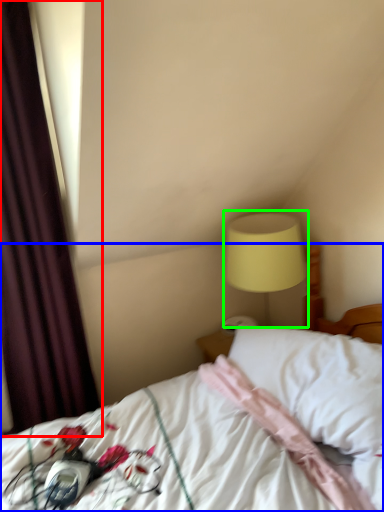
Question: Which object is positioned closest to curtain (highlighted by a red box)? Select from bed (highlighted by a blue box) and bedside lamp (highlighted by a green box).

Choices:
 (A) bed
 (B) bedside lamp

Answer: (A)